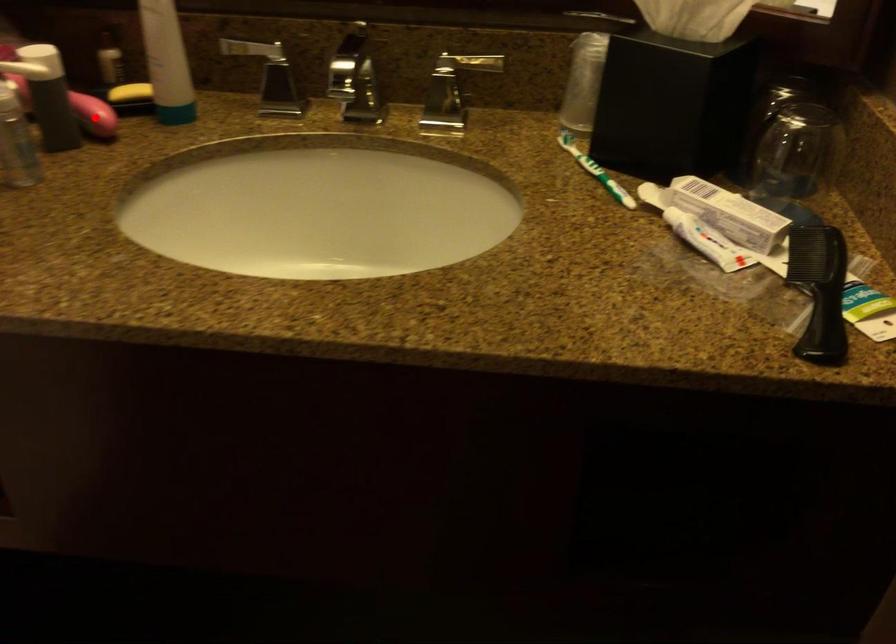
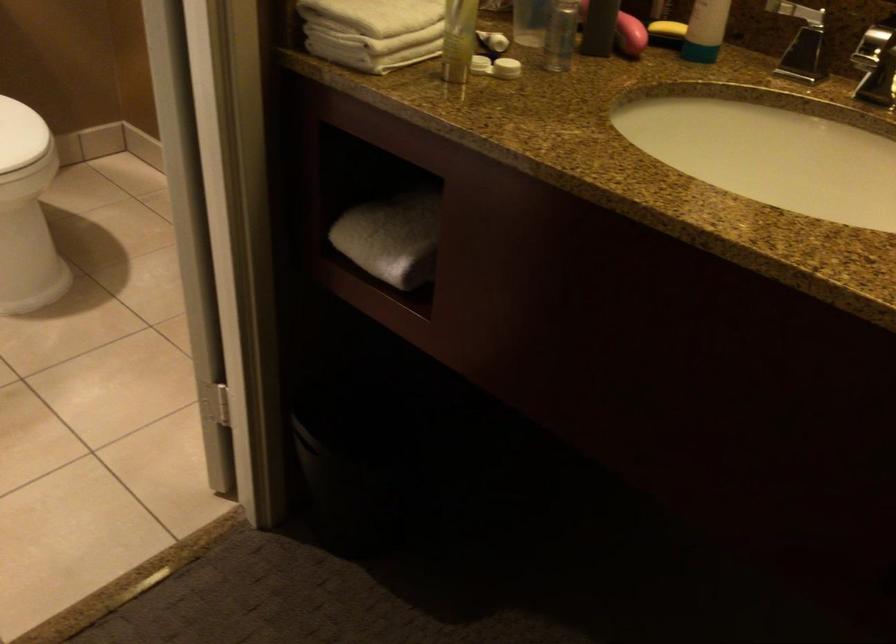
Question: A red point is marked in image1. In image2, is the corresponding 3D point closer to the camera or farther? Reply with the corresponding letter.

Choices:
 (A) The corresponding 3D point is closer.
 (B) The corresponding 3D point is farther.

Answer: (B)